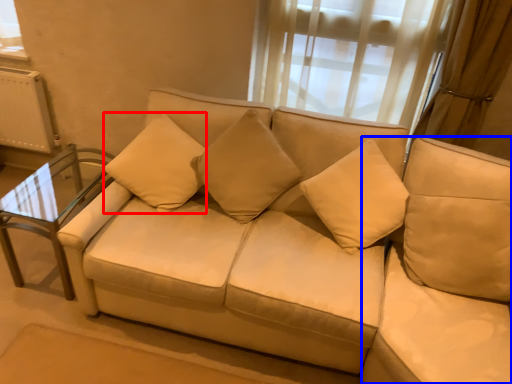
Question: Among these objects, which one is nearest to the camera, pillow (highlighted by a red box) or beige (highlighted by a blue box)?

Choices:
 (A) pillow
 (B) beige

Answer: (B)